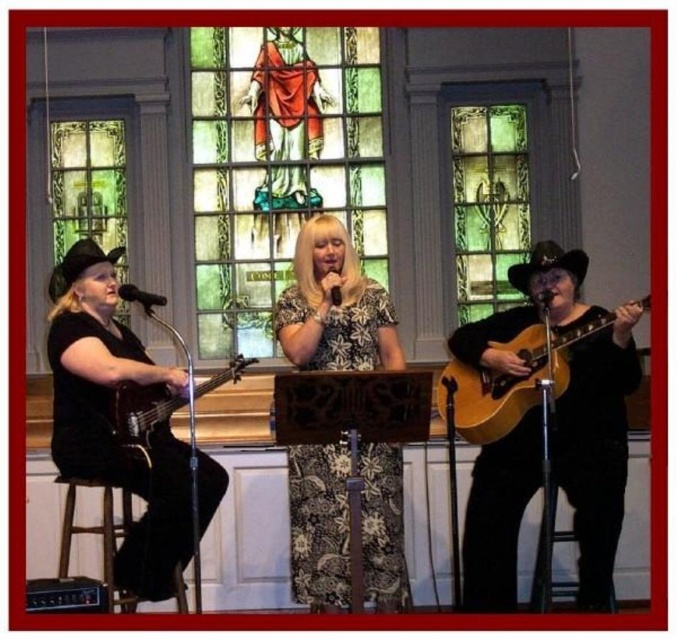
Between green stained glass at left and matte black guitar at left, which one appears on the left side from the viewer's perspective?

From the viewer's perspective, green stained glass at left appears more on the left side.

Is green stained glass at left taller than matte black guitar at left?

Yes.

Where is `green stained glass at left`? The height and width of the screenshot is (640, 677). green stained glass at left is located at coordinates (74, 189).

The width and height of the screenshot is (677, 640). Find the location of `green stained glass at left`. green stained glass at left is located at coordinates (74, 189).

Is matte black guitar at left to the left of brown wooden bar stool at lower left from the viewer's perspective?

No, matte black guitar at left is not to the left of brown wooden bar stool at lower left.

Can you confirm if matte black guitar at left is bigger than brown wooden bar stool at lower left?

Incorrect, matte black guitar at left is not larger than brown wooden bar stool at lower left.

At what (x,y) coordinates should I click in order to perform the action: click on matte black guitar at left. Please return your answer as a coordinate pair (x, y). This screenshot has width=677, height=640. Looking at the image, I should click on (141, 417).

Which of these two, floral fabric dress at center or natural wood acoustic guitar at right, stands shorter?

With less height is natural wood acoustic guitar at right.

Does floral fabric dress at center appear over natural wood acoustic guitar at right?

Correct, floral fabric dress at center is located above natural wood acoustic guitar at right.

Describe the element at coordinates (334, 307) in the screenshot. This screenshot has width=677, height=640. I see `floral fabric dress at center` at that location.

Identify the location of floral fabric dress at center. This screenshot has height=640, width=677. (334, 307).